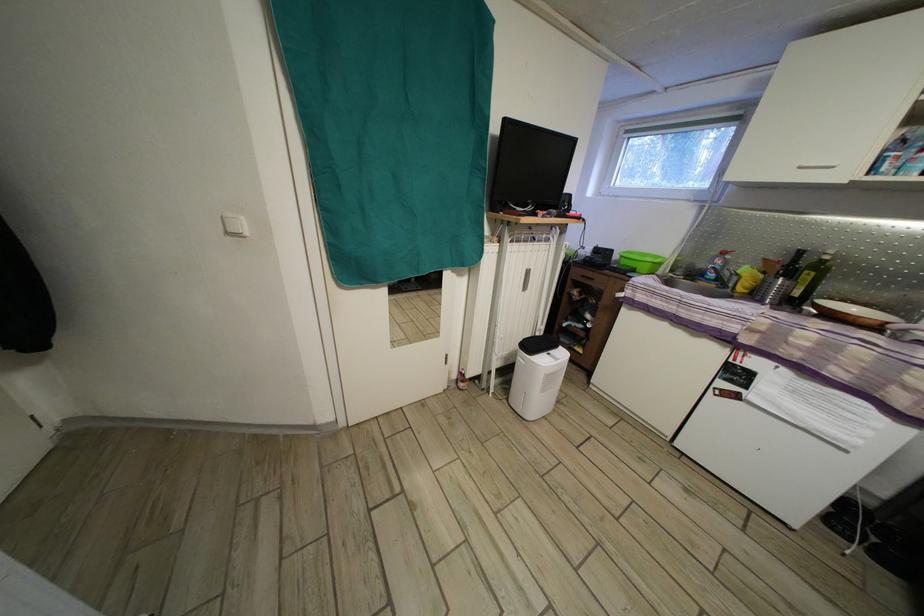
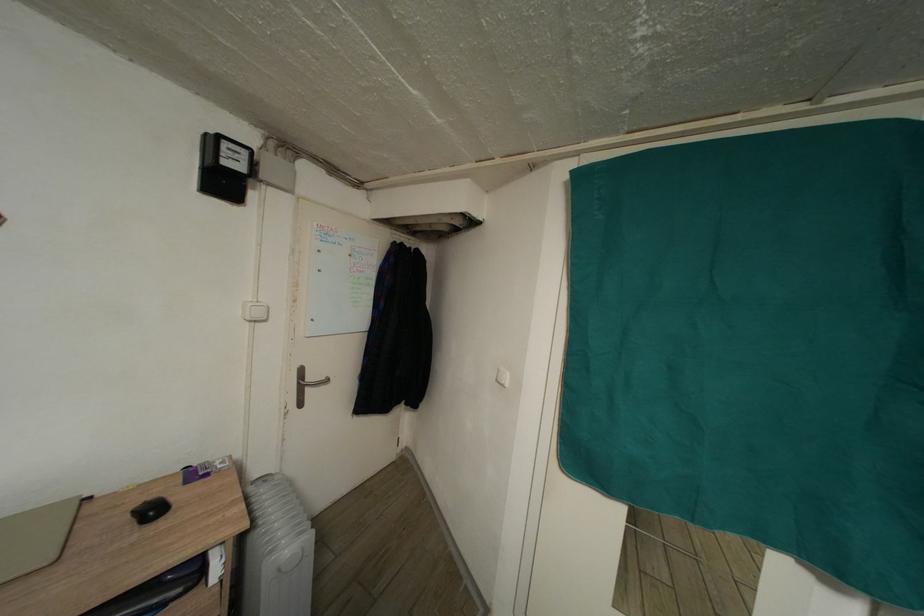
Question: The camera is either moving clockwise (left) or counter-clockwise (right) around the object. The first image is from the beginning of the video and the second image is from the end. Is the camera moving left or right when shooting the video?

Choices:
 (A) Left
 (B) Right

Answer: (B)